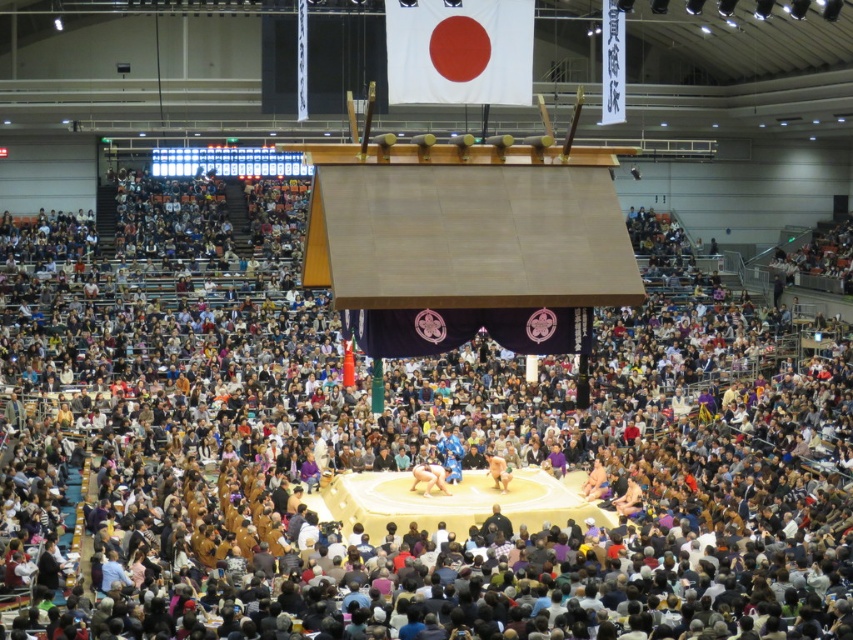
Describe the element at coordinates (459, 51) in the screenshot. I see `white fabric flag at upper center` at that location.

Between white fabric flag at upper center and smooth beige sumo wrestler at center, which one appears on the right side from the viewer's perspective?

Positioned to the right is smooth beige sumo wrestler at center.

Where is `white fabric flag at upper center`? Image resolution: width=853 pixels, height=640 pixels. white fabric flag at upper center is located at coordinates (459, 51).